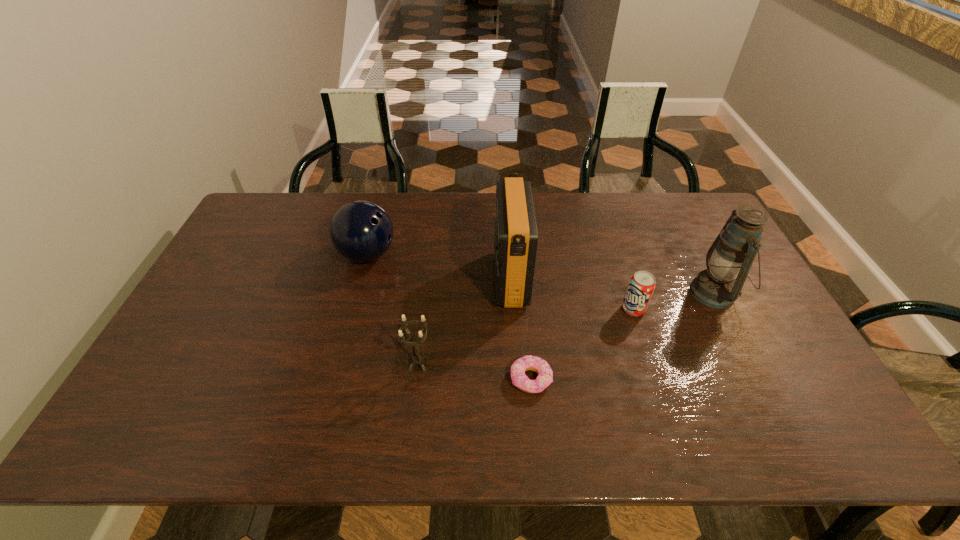
I want to click on the rightmost object, so click(x=730, y=257).

What are the coordinates of `radio receiver` in the screenshot? It's located at (516, 236).

Where is `bowling ball`? bowling ball is located at coordinates (361, 231).

The image size is (960, 540). Find the location of `the third shortest object`. the third shortest object is located at coordinates (416, 358).

This screenshot has height=540, width=960. Identify the location of the fifth object from right to left. (416, 358).

Locate an element on the screen. the fifth object from left to right is located at coordinates (642, 284).

The width and height of the screenshot is (960, 540). Identify the location of soda can. (642, 284).

This screenshot has height=540, width=960. What are the coordinates of `doughnut` in the screenshot? It's located at (545, 374).

In order to click on vacant space located 0.400m on the back of the oil lamp in this screenshot , I will do point(665,195).

Find the location of a particular element. The width and height of the screenshot is (960, 540). free location located on the front-facing side of the radio receiver is located at coordinates (468, 279).